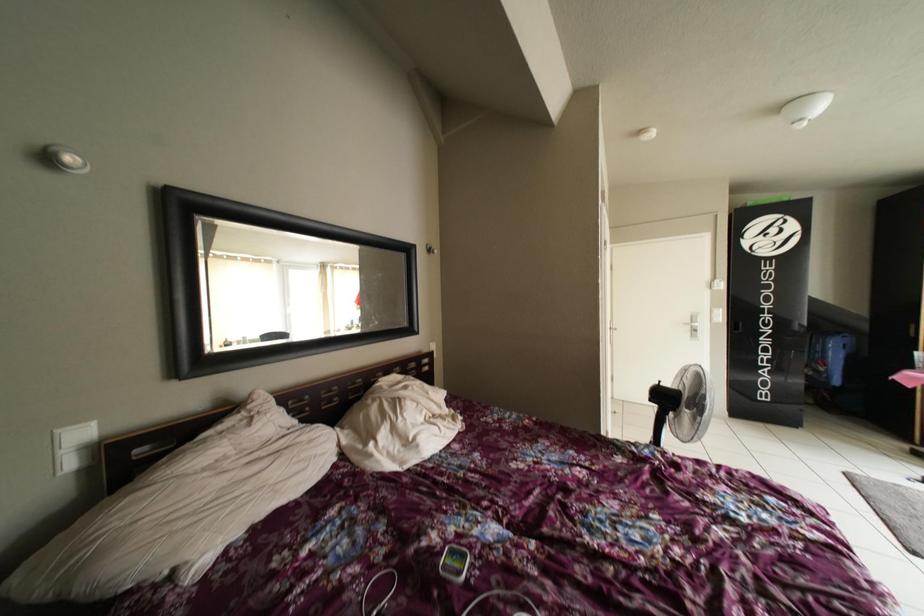
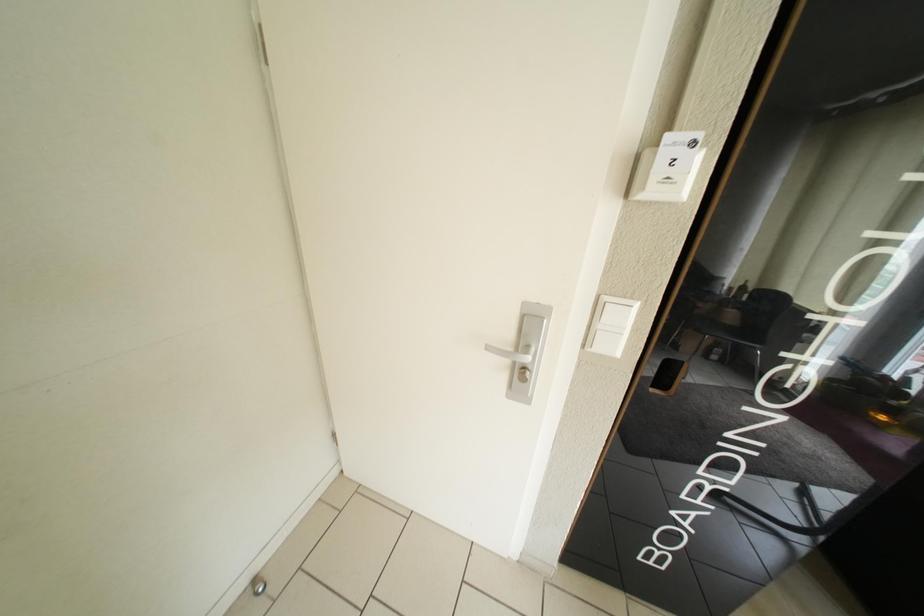
The images are taken continuously from a first-person perspective. In which direction are you moving?

The cameraman moved toward right, forward.